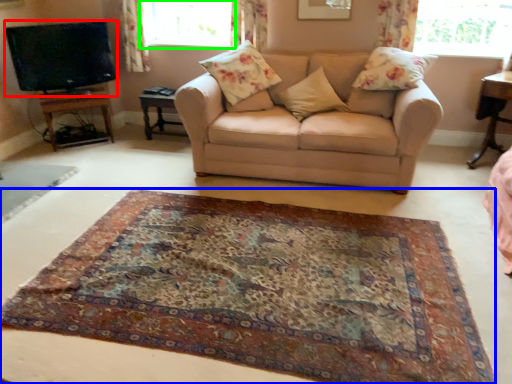
Question: Which object is positioned closest to television (highlighted by a red box)? Select from mat (highlighted by a blue box) and window (highlighted by a green box).

Choices:
 (A) mat
 (B) window

Answer: (B)